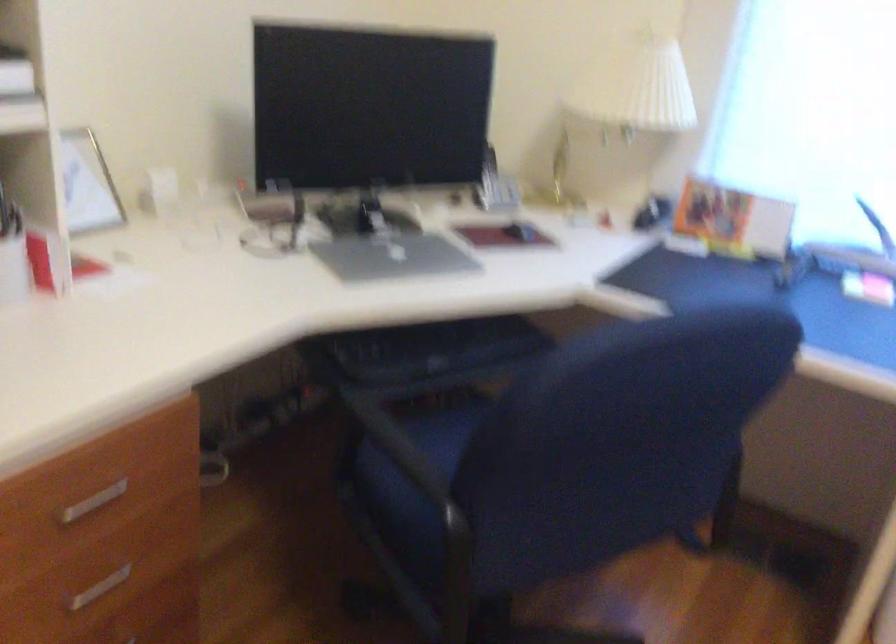
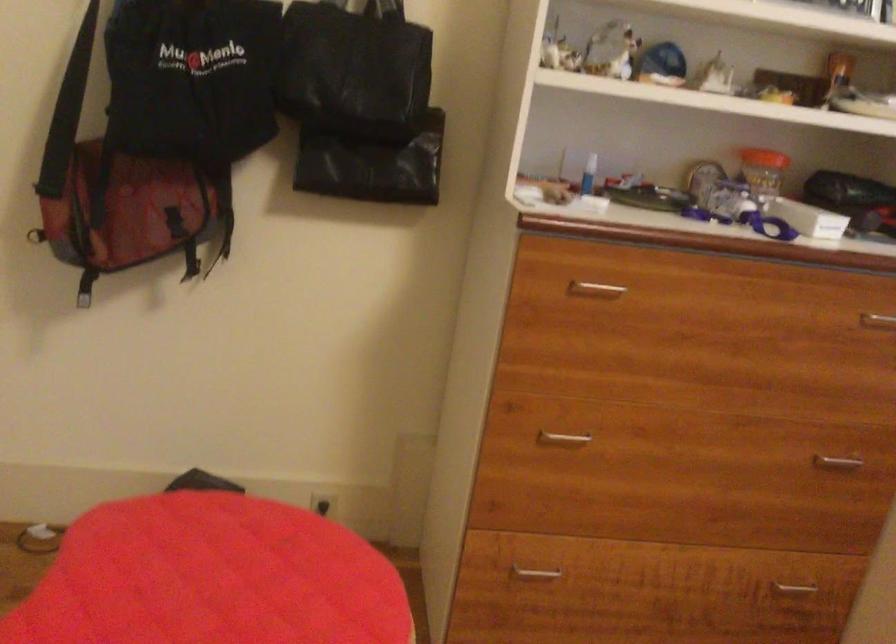
Question: The camera is either moving clockwise (left) or counter-clockwise (right) around the object. The first image is from the beginning of the video and the second image is from the end. Is the camera moving left or right when shooting the video?

Choices:
 (A) Left
 (B) Right

Answer: (B)